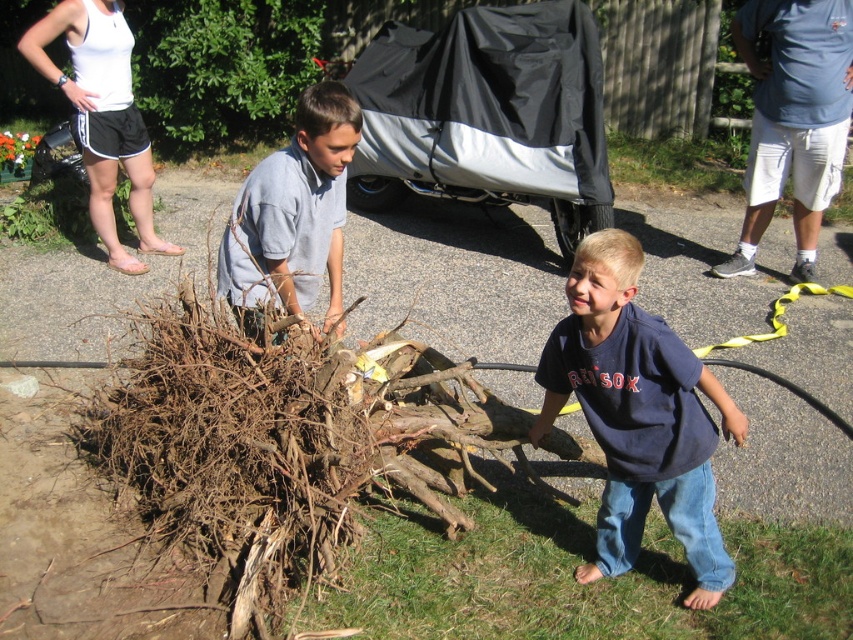
Question: Does blue cotton shirt at center appear on the left side of gray cotton shirt at center?

Choices:
 (A) yes
 (B) no

Answer: (B)

Question: Which point appears farthest from the camera in this image?

Choices:
 (A) (322, 147)
 (B) (698, 513)

Answer: (A)

Question: Which point is farther from the camera taking this photo?

Choices:
 (A) (619, 380)
 (B) (294, 243)

Answer: (B)

Question: Is blue cotton shirt at center smaller than gray cotton shirt at center?

Choices:
 (A) no
 (B) yes

Answer: (A)

Question: Can you confirm if blue cotton shirt at center is positioned below gray cotton shirt at center?

Choices:
 (A) no
 (B) yes

Answer: (B)